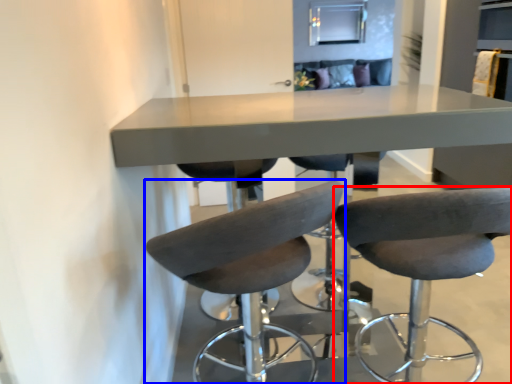
Question: Which of the following is the closest to the observer, chair (highlighted by a red box) or chair (highlighted by a blue box)?

Choices:
 (A) chair
 (B) chair

Answer: (B)